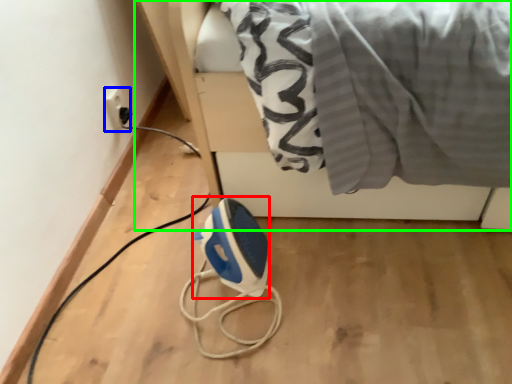
Question: Based on their relative distances, which object is nearer to appliance (highlighted by a red box)? Choose from electric outlet (highlighted by a blue box) and furniture (highlighted by a green box).

Choices:
 (A) electric outlet
 (B) furniture

Answer: (B)